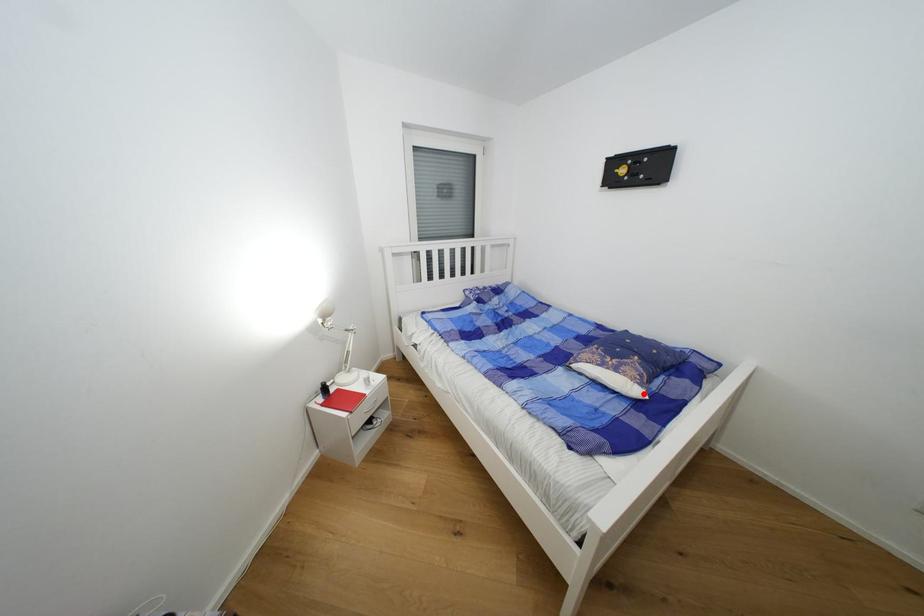
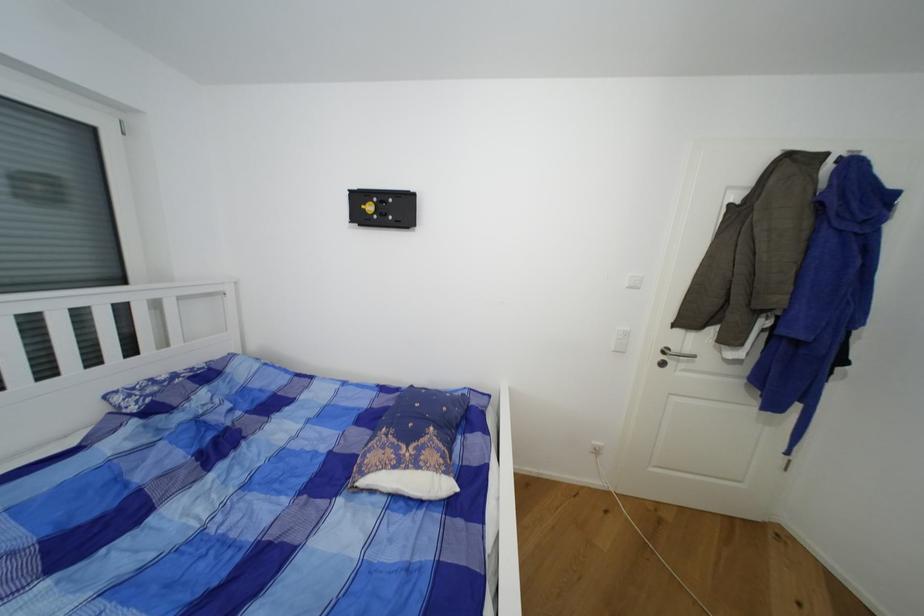
Find the pixel in the second image that matches the highlighted location in the first image.

(454, 488)